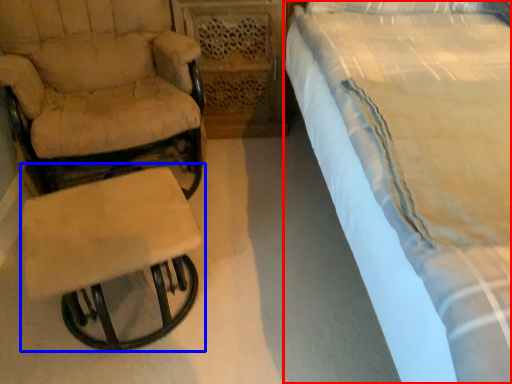
Question: Which object is closer to the camera taking this photo, bed (highlighted by a red box) or table (highlighted by a blue box)?

Choices:
 (A) bed
 (B) table

Answer: (A)